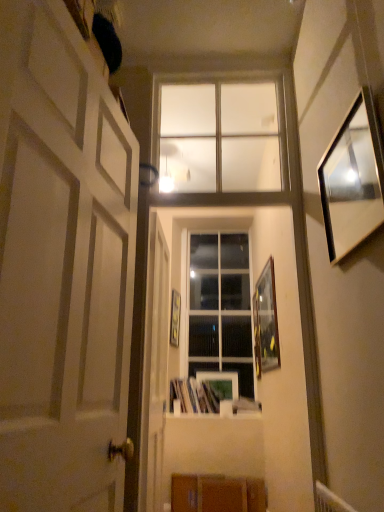
This screenshot has width=384, height=512. Identify the location of vacant space situated above clear glass window at upper center, arranged as the 2th window when ordered from the bottom (from a real-world perspective). (227, 66).